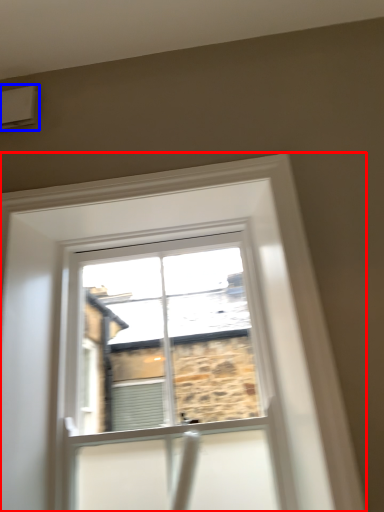
Question: Which object appears farthest to the camera in this image, window (highlighted by a red box) or air conditioning (highlighted by a blue box)?

Choices:
 (A) window
 (B) air conditioning

Answer: (B)